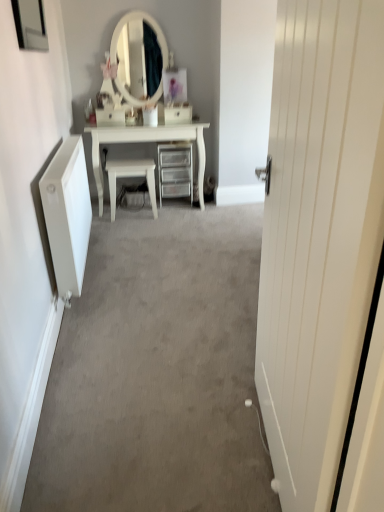
Question: Is white glossy chair at center at the left side of white wooden door at right?

Choices:
 (A) yes
 (B) no

Answer: (A)

Question: Is white glossy chair at center outside white wooden door at right?

Choices:
 (A) yes
 (B) no

Answer: (A)

Question: Are white glossy chair at center and white wooden door at right located far from each other?

Choices:
 (A) yes
 (B) no

Answer: (A)

Question: From the image's perspective, is white glossy chair at center above white wooden door at right?

Choices:
 (A) yes
 (B) no

Answer: (A)

Question: Is white glossy chair at center next to white wooden door at right?

Choices:
 (A) no
 (B) yes

Answer: (A)

Question: Is white glossy drawer at center, the first drawer from the left, wider or thinner than white glossy chair at center?

Choices:
 (A) thin
 (B) wide

Answer: (A)

Question: Based on their sizes in the image, would you say white glossy drawer at center, the first drawer from the left, is bigger or smaller than white glossy chair at center?

Choices:
 (A) small
 (B) big

Answer: (A)

Question: In the image, is white glossy drawer at center, the first drawer from the left, positioned in front of or behind white glossy chair at center?

Choices:
 (A) front
 (B) behind

Answer: (B)

Question: From the image's perspective, relative to white glossy chair at center, is white glossy drawer at center, the first drawer from the left, above or below?

Choices:
 (A) below
 (B) above

Answer: (B)

Question: Is white plastic drawer at center, which appears as the 1th drawer when viewed from the right, taller or shorter than clear plastic drawers at center?

Choices:
 (A) short
 (B) tall

Answer: (A)

Question: Which is correct: white plastic drawer at center, acting as the second drawer starting from the left, is inside clear plastic drawers at center, or outside of it?

Choices:
 (A) outside
 (B) inside

Answer: (A)

Question: Is point (182, 120) positioned closer to the camera than point (162, 196)?

Choices:
 (A) farther
 (B) closer

Answer: (B)

Question: Is white plastic drawer at center, acting as the second drawer starting from the left, to the left or to the right of clear plastic drawers at center in the image?

Choices:
 (A) left
 (B) right

Answer: (B)

Question: Visually, is white glossy drawer at center, marked as the second drawer in a right-to-left arrangement, positioned to the left or to the right of clear plastic drawers at center?

Choices:
 (A) left
 (B) right

Answer: (A)

Question: In terms of width, does white glossy drawer at center, the first drawer from the left, look wider or thinner when compared to clear plastic drawers at center?

Choices:
 (A) wide
 (B) thin

Answer: (B)